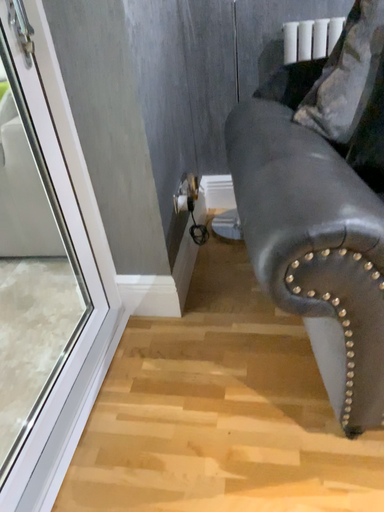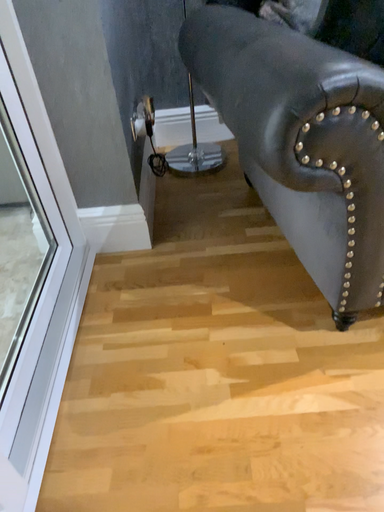
Question: How did the camera likely rotate when shooting the video?

Choices:
 (A) rotated left
 (B) rotated right

Answer: (B)